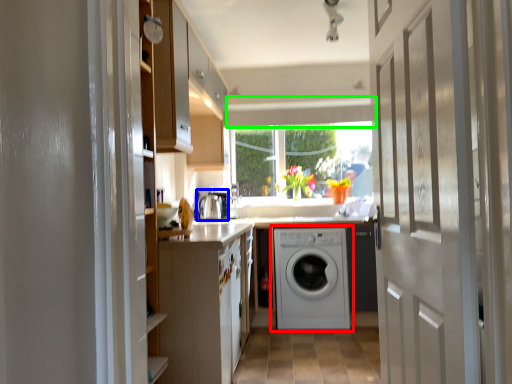
Question: Which is farther away from washing machine (highlighted by a red box)? appliance (highlighted by a blue box) or exhaust hood (highlighted by a green box)?

Choices:
 (A) appliance
 (B) exhaust hood

Answer: (B)